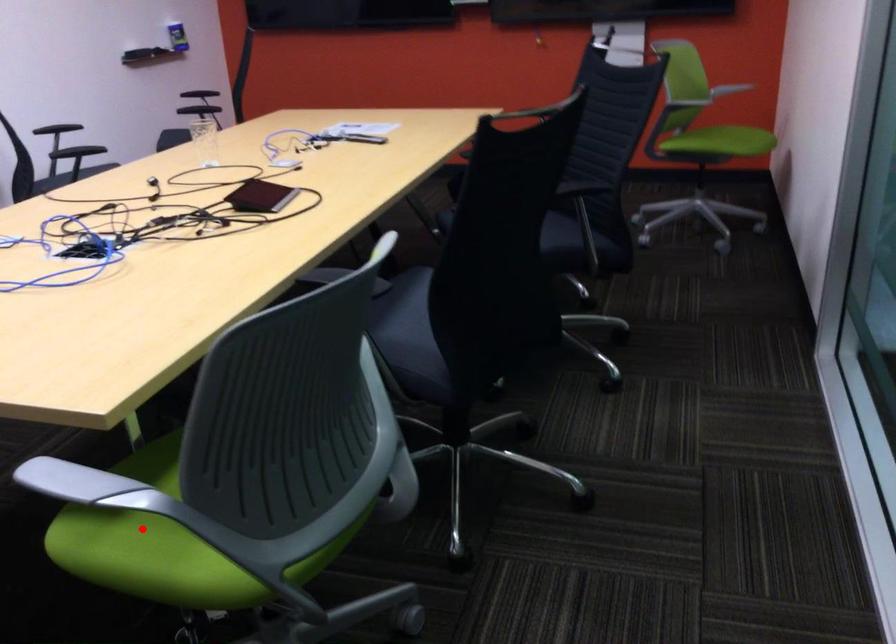
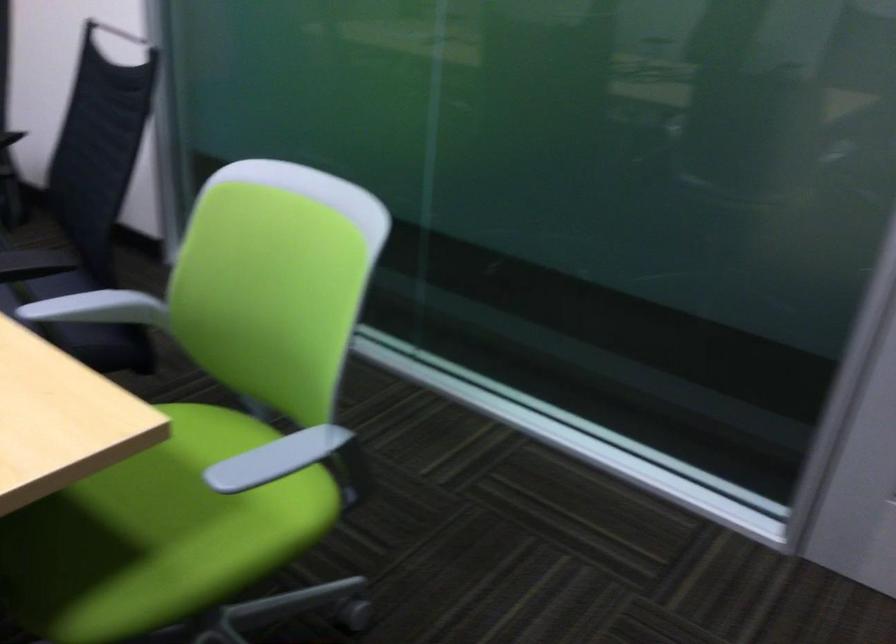
Question: I am providing you with two images of the same scene from different viewpoints. A red point is marked on the first image. Is the red point's position out of view in image 2?

Choices:
 (A) Yes
 (B) No

Answer: (B)